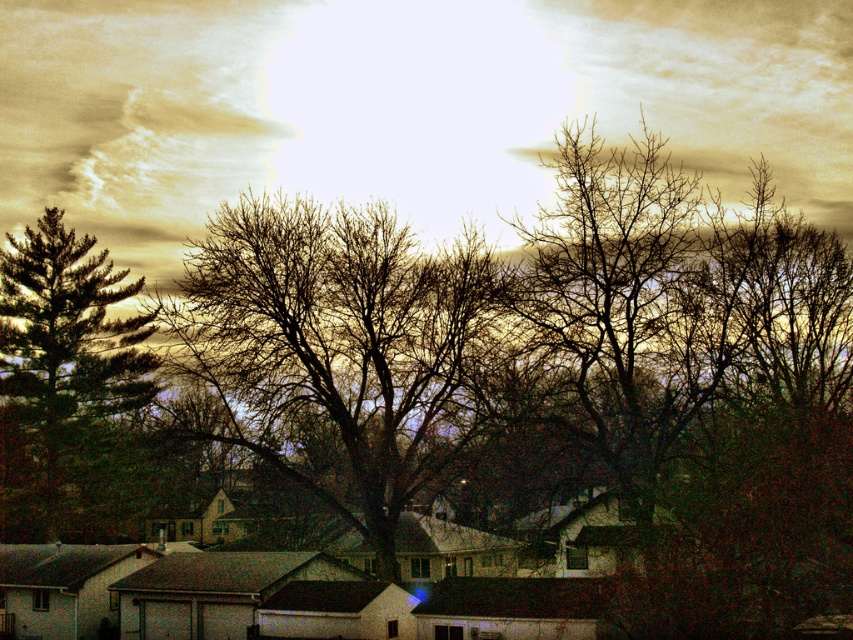
Does bare branches at center lie in front of green matte tree at left?

Yes, bare branches at center is closer to the viewer.

Is point (300, 260) closer to viewer compared to point (45, 301)?

Yes, it is in front of point (45, 301).

The height and width of the screenshot is (640, 853). I want to click on bare branches at center, so click(x=335, y=349).

Based on the photo, does white cotton cloud at upper center have a lesser width compared to bare branches at center?

Incorrect, white cotton cloud at upper center's width is not less than bare branches at center's.

Does white cotton cloud at upper center appear under bare branches at center?

No.

Is point (248, 74) behind point (239, 253)?

Yes, point (248, 74) is farther from viewer.

In order to click on white cotton cloud at upper center in this screenshot , I will do `click(401, 106)`.

Can you confirm if white cotton cloud at upper center is positioned to the left of green matte tree at left?

Incorrect, white cotton cloud at upper center is not on the left side of green matte tree at left.

Is white cotton cloud at upper center smaller than green matte tree at left?

Incorrect, white cotton cloud at upper center is not smaller in size than green matte tree at left.

Who is more distant from viewer, [846,230] or [4,378]?

The point [4,378] is behind.

Identify the location of white cotton cloud at upper center. The height and width of the screenshot is (640, 853). (401, 106).